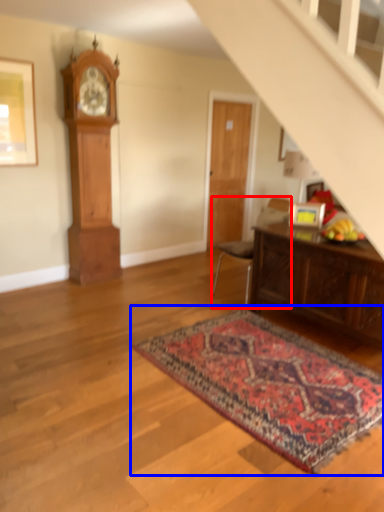
Question: Which point is closer to the camera, chair (highlighted by a red box) or mat (highlighted by a blue box)?

Choices:
 (A) chair
 (B) mat

Answer: (B)